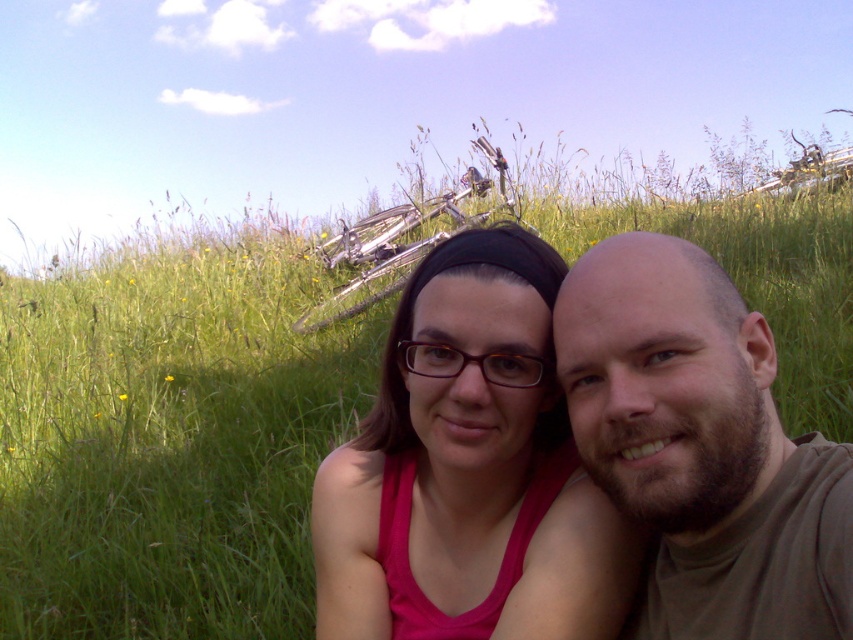
Question: Which object appears farthest from the camera in this image?

Choices:
 (A) pink fabric tank top at center
 (B) brown matte shirt at center

Answer: (A)

Question: Does pink fabric tank top at center appear on the right side of brown matte shirt at center?

Choices:
 (A) yes
 (B) no

Answer: (B)

Question: In this image, where is pink fabric tank top at center located relative to brown matte shirt at center?

Choices:
 (A) above
 (B) below

Answer: (B)

Question: Which point is farther from the camera taking this photo?

Choices:
 (A) (664, 413)
 (B) (518, 300)

Answer: (B)

Question: Does pink fabric tank top at center have a larger size compared to brown matte shirt at center?

Choices:
 (A) yes
 (B) no

Answer: (A)